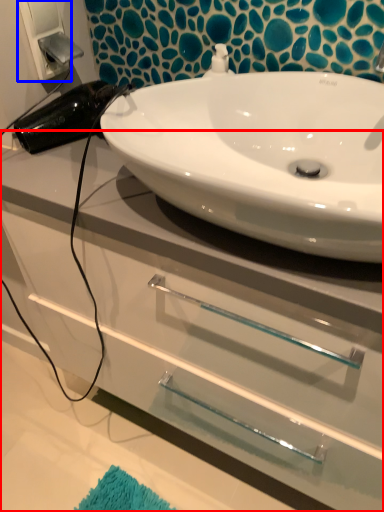
Question: Among these objects, which one is farthest to the camera, bathroom cabinet (highlighted by a red box) or electric outlet (highlighted by a blue box)?

Choices:
 (A) bathroom cabinet
 (B) electric outlet

Answer: (B)